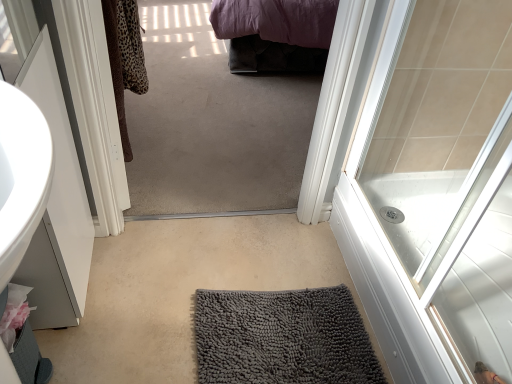
This screenshot has width=512, height=384. I want to click on vacant space in gray chenille bath mat at center (from a real-world perspective), so click(275, 334).